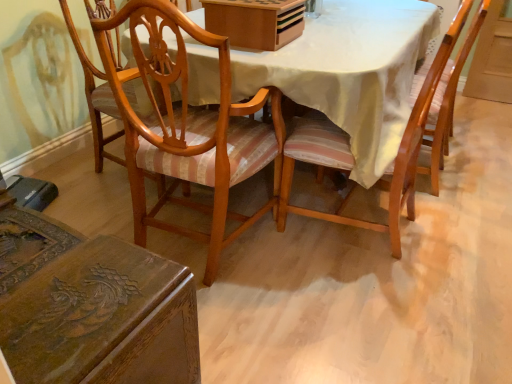
You are a GUI agent. You are given a task and a screenshot of the screen. Output one action in this format:
    pyautogui.click(x=<x>, y=<y>)
    Task: Click on the empty space that is ontop of polished wood chair at lower left, which is the 1th chair from left to right
    This screenshot has width=512, height=384.
    Given the screenshot: What is the action you would take?
    pyautogui.click(x=61, y=276)